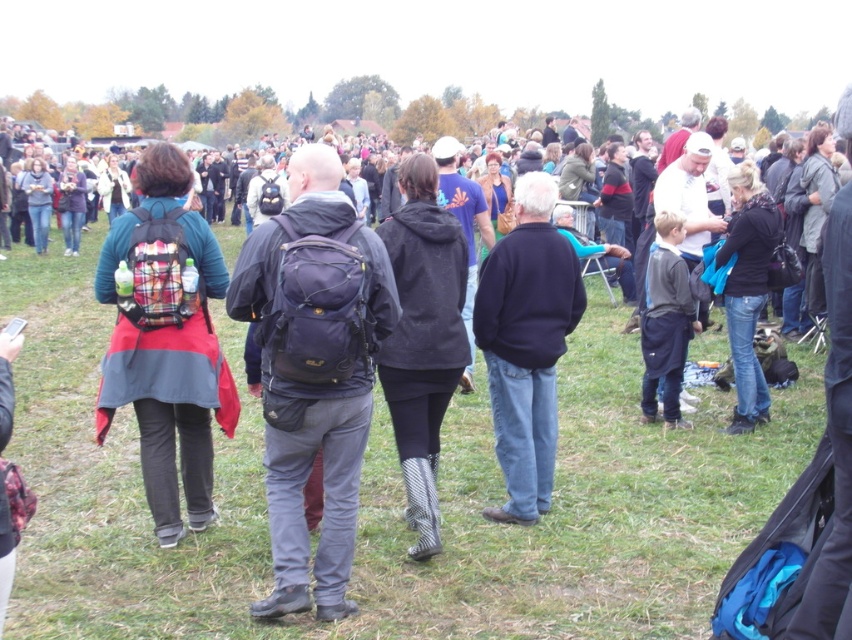
Does point (377, 266) lie behind point (543, 470)?

That is False.

Can you confirm if matte black backpack at center is positioned above dark blue sweater at center?

No, matte black backpack at center is not above dark blue sweater at center.

Does point (344, 211) lie behind point (482, 292)?

No, it is in front of (482, 292).

Locate an element on the screen. matte black backpack at center is located at coordinates (314, 371).

Is plaid fabric backpack at left positioned behind dark gray fabric jacket at center-right?

No, it is not.

This screenshot has width=852, height=640. I want to click on plaid fabric backpack at left, so click(x=165, y=342).

Which is above, plaid fabric backpack at left or black textured boots at center?

plaid fabric backpack at left

Image resolution: width=852 pixels, height=640 pixels. Describe the element at coordinates (165, 342) in the screenshot. I see `plaid fabric backpack at left` at that location.

At what (x,y) coordinates should I click in order to perform the action: click on plaid fabric backpack at left. Please return your answer as a coordinate pair (x, y). This screenshot has height=640, width=852. Looking at the image, I should click on (165, 342).